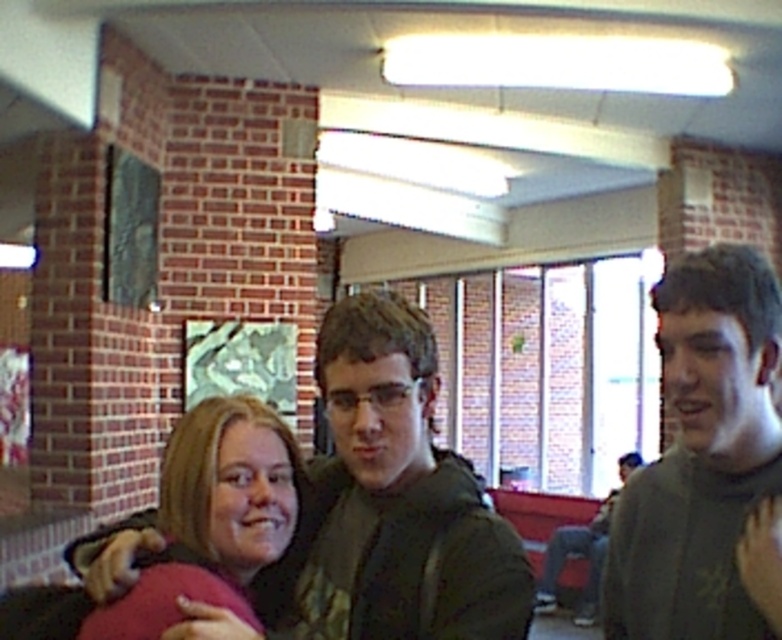
Question: Which point is farther to the camera?

Choices:
 (A) dark gray jacket at right
 (B) dark green hoodie at center
 (C) blonde hair at center
 (D) matte green sweater at center

Answer: (A)

Question: Which of the following is the farthest from the observer?

Choices:
 (A) dark gray jacket at right
 (B) dark green hoodie at center
 (C) blonde hair at center

Answer: (A)

Question: In this image, where is dark green hoodie at center located relative to dark gray jacket at right?

Choices:
 (A) right
 (B) left

Answer: (B)

Question: Considering the relative positions of blonde hair at center and dark gray jacket at right in the image provided, where is blonde hair at center located with respect to dark gray jacket at right?

Choices:
 (A) above
 (B) below

Answer: (A)

Question: Observing the image, what is the correct spatial positioning of dark green hoodie at center in reference to dark gray jacket at right?

Choices:
 (A) left
 (B) right

Answer: (A)

Question: Which is farther from the blonde hair at center?

Choices:
 (A) dark gray jacket at right
 (B) dark green hoodie at center

Answer: (A)